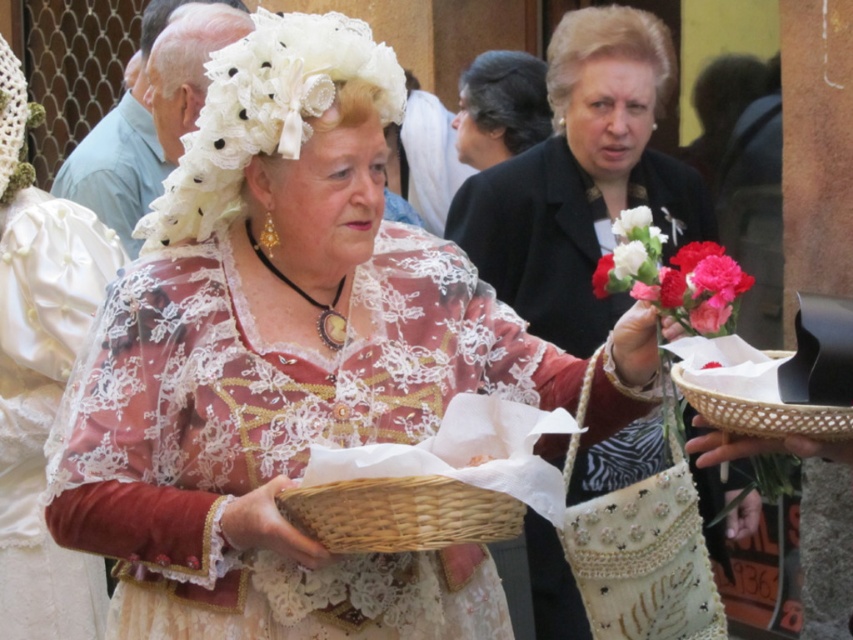
Is white lace hat at upper left thinner than white lace headdress at upper center?

Correct, white lace hat at upper left's width is less than white lace headdress at upper center's.

Between white lace hat at upper left and white lace headdress at upper center, which one appears on the left side from the viewer's perspective?

white lace hat at upper left

Describe the element at coordinates (39, 376) in the screenshot. I see `white lace hat at upper left` at that location.

At what (x,y) coordinates should I click in order to perform the action: click on white lace hat at upper left. Please return your answer as a coordinate pair (x, y). This screenshot has height=640, width=853. Looking at the image, I should click on (39, 376).

From the picture: Is white lace headdress at upper center thinner than woven wicker basket at center?

Incorrect, white lace headdress at upper center's width is not less than woven wicker basket at center's.

What do you see at coordinates (264, 113) in the screenshot? I see `white lace headdress at upper center` at bounding box center [264, 113].

Locate an element on the screen. white lace headdress at upper center is located at coordinates (264, 113).

Between lace fabric dress at center and smooth silk bouquet at center, which one is positioned lower?

lace fabric dress at center is lower down.

Is lace fabric dress at center thinner than smooth silk bouquet at center?

Yes.

The height and width of the screenshot is (640, 853). What are the coordinates of `lace fabric dress at center` in the screenshot? It's located at (280, 362).